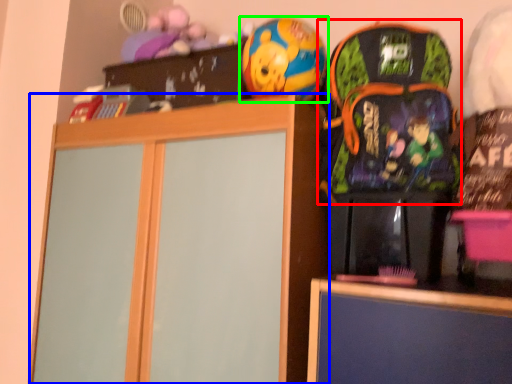
Question: Which object is the closest to the backpack (highlighted by a red box)? Choose among these: cabinetry (highlighted by a blue box) or toy (highlighted by a green box).

Choices:
 (A) cabinetry
 (B) toy

Answer: (B)